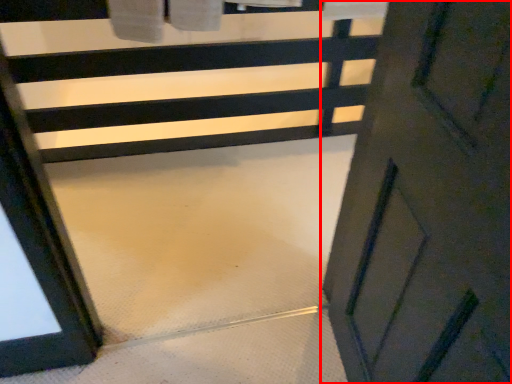
Question: In this image, where is door (annotated by the red box) located relative to stair?

Choices:
 (A) right
 (B) left

Answer: (A)